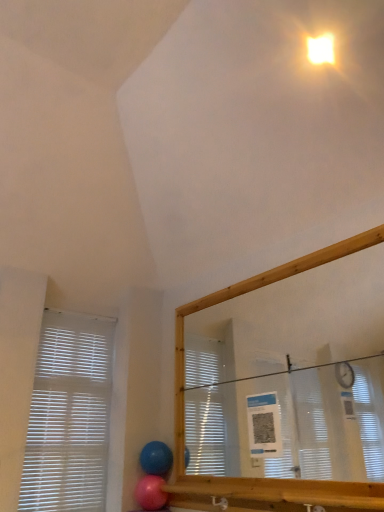
Question: Is white plastic blinds at left closer to camera compared to blue rubber balloon at lower center, the second balloon from the bottom?

Choices:
 (A) no
 (B) yes

Answer: (B)

Question: Is white plastic blinds at left shorter than blue rubber balloon at lower center, the second balloon from the bottom?

Choices:
 (A) no
 (B) yes

Answer: (A)

Question: Does white plastic blinds at left appear on the right side of blue rubber balloon at lower center, the first balloon from the top?

Choices:
 (A) no
 (B) yes

Answer: (A)

Question: Are white plastic blinds at left and blue rubber balloon at lower center, the first balloon from the top, far apart?

Choices:
 (A) yes
 (B) no

Answer: (B)

Question: Is white plastic blinds at left turned away from blue rubber balloon at lower center, the second balloon from the bottom?

Choices:
 (A) no
 (B) yes

Answer: (A)

Question: From a real-world perspective, is white plastic blinds at left under blue rubber balloon at lower center, the second balloon from the bottom?

Choices:
 (A) no
 (B) yes

Answer: (A)

Question: Could pink rubber balloon at lower center, positioned as the first balloon in bottom-to-top order, be considered to be inside bright yellow plastic light at upper right?

Choices:
 (A) yes
 (B) no

Answer: (B)

Question: Considering the relative sizes of bright yellow plastic light at upper right and pink rubber balloon at lower center, acting as the 2th balloon starting from the top, in the image provided, is bright yellow plastic light at upper right thinner than pink rubber balloon at lower center, acting as the 2th balloon starting from the top,?

Choices:
 (A) no
 (B) yes

Answer: (B)

Question: Is bright yellow plastic light at upper right not within pink rubber balloon at lower center, positioned as the first balloon in bottom-to-top order?

Choices:
 (A) yes
 (B) no

Answer: (A)

Question: Considering the relative sizes of bright yellow plastic light at upper right and pink rubber balloon at lower center, acting as the 2th balloon starting from the top, in the image provided, is bright yellow plastic light at upper right taller than pink rubber balloon at lower center, acting as the 2th balloon starting from the top,?

Choices:
 (A) no
 (B) yes

Answer: (A)

Question: Can you confirm if bright yellow plastic light at upper right is shorter than pink rubber balloon at lower center, acting as the 2th balloon starting from the top?

Choices:
 (A) no
 (B) yes

Answer: (B)

Question: Is bright yellow plastic light at upper right next to pink rubber balloon at lower center, positioned as the first balloon in bottom-to-top order, and touching it?

Choices:
 (A) no
 (B) yes

Answer: (A)

Question: Is blue rubber balloon at lower center, the second balloon from the bottom, thinner than bright yellow plastic light at upper right?

Choices:
 (A) yes
 (B) no

Answer: (B)